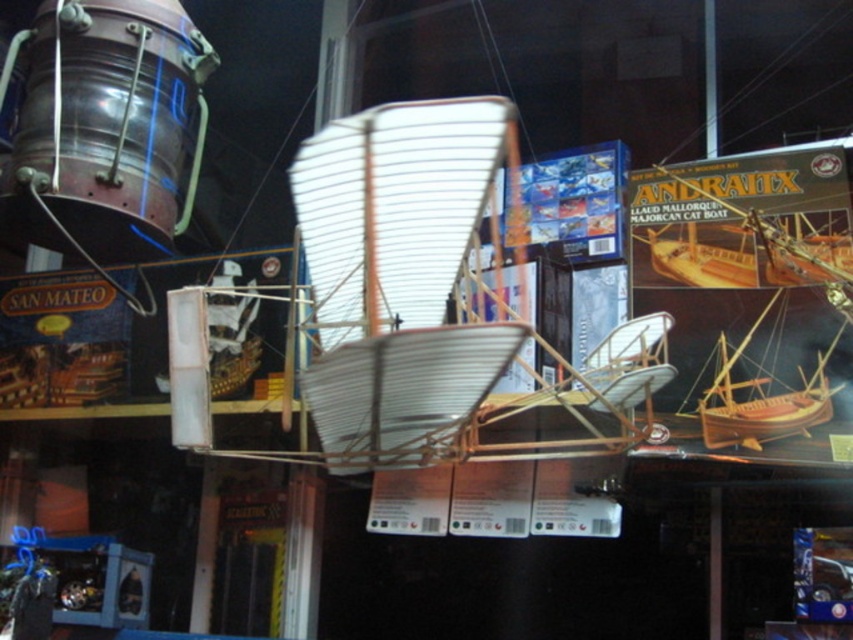
What are the coordinates of `metallic drum at upper left` in the screenshot? It's located at (108, 124).

Locate an element on the screen. metallic drum at upper left is located at coordinates (108, 124).